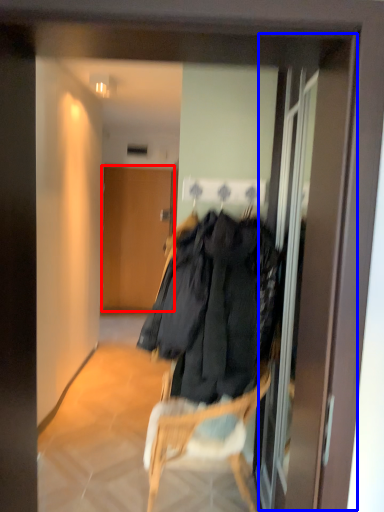
Question: Which of the following is the farthest to the observer, door (highlighted by a red box) or screen door (highlighted by a blue box)?

Choices:
 (A) door
 (B) screen door

Answer: (A)